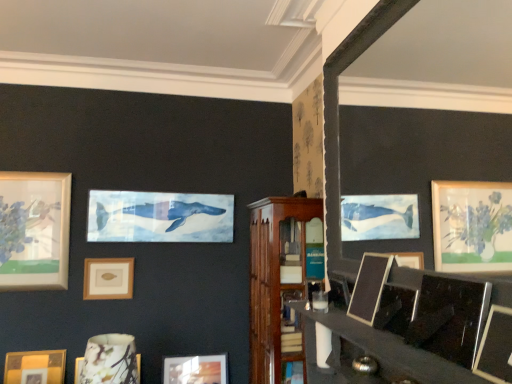
What do you see at coordinates (35, 367) in the screenshot? I see `matte gold picture frame at lower left, which ranks as the 4th picture frame in front-to-back order` at bounding box center [35, 367].

Locate an element on the screen. The width and height of the screenshot is (512, 384). matte wooden picture frame at lower center, which ranks as the second picture frame in back-to-front order is located at coordinates (195, 369).

This screenshot has height=384, width=512. I want to click on wooden picture frame at center, which ranks as the third picture frame in front-to-back order, so click(x=369, y=286).

What is the approximate width of shiny black picture frame at lower right, the sixth picture frame when ordered from left to right?

The width of shiny black picture frame at lower right, the sixth picture frame when ordered from left to right, is 3.60 inches.

The width and height of the screenshot is (512, 384). Find the location of `wooden cabinet at center`. wooden cabinet at center is located at coordinates (279, 281).

Locate an element on the screen. This screenshot has height=384, width=512. matte gold picture frame at lower left, the first picture frame when ordered from left to right is located at coordinates (35, 367).

Visually, is matte gold picture frame at lower left, which ranks as the 4th picture frame in front-to-back order, positioned to the left or to the right of wooden picture frame at center, which is counted as the 5th picture frame, starting from the left?

matte gold picture frame at lower left, which ranks as the 4th picture frame in front-to-back order, is positioned on wooden picture frame at center, which is counted as the 5th picture frame, starting from the left,'s left side.

Is the position of matte gold picture frame at lower left, which ranks as the fourth picture frame in back-to-front order, more distant than that of wooden picture frame at center, which is counted as the 5th picture frame, starting from the left?

Yes, the depth of matte gold picture frame at lower left, which ranks as the fourth picture frame in back-to-front order, is greater than that of wooden picture frame at center, which is counted as the 5th picture frame, starting from the left.

From a real-world perspective, is matte gold picture frame at lower left, which ranks as the 7th picture frame in right-to-left order, positioned above or below wooden picture frame at center, the 3th picture frame in the right-to-left sequence?

matte gold picture frame at lower left, which ranks as the 7th picture frame in right-to-left order, is below wooden picture frame at center, the 3th picture frame in the right-to-left sequence.

Does matte gold picture frame at lower left, the first picture frame when ordered from left to right, touch wooden picture frame at center, the 3th picture frame in the right-to-left sequence?

No.

Which object is further away from the camera, matte wooden picture frame at lower center, the fourth picture frame positioned from the right, or matte gold picture frame at lower left, which ranks as the 7th picture frame in right-to-left order?

Positioned behind is matte wooden picture frame at lower center, the fourth picture frame positioned from the right.

Starting from the matte gold picture frame at lower left, which ranks as the 7th picture frame in right-to-left order, which picture frame is the 3rd one to the right? Please provide its 2D coordinates.

[(195, 369)]

Is matte wooden picture frame at lower center, the fourth picture frame positioned from the right, oriented towards matte gold picture frame at lower left, which ranks as the fourth picture frame in back-to-front order?

No, matte wooden picture frame at lower center, the fourth picture frame positioned from the right, is not oriented towards matte gold picture frame at lower left, which ranks as the fourth picture frame in back-to-front order.

Is matte wooden picture frame at lower center, the sixth picture frame in the front-to-back sequence, shorter than matte gold picture frame at lower left, which ranks as the 4th picture frame in front-to-back order?

In fact, matte wooden picture frame at lower center, the sixth picture frame in the front-to-back sequence, may be taller than matte gold picture frame at lower left, which ranks as the 4th picture frame in front-to-back order.

Where is `the 2nd picture frame above the matte gold picture frame at lower left, which ranks as the fourth picture frame in back-to-front order (from a real-world perspective)`? Image resolution: width=512 pixels, height=384 pixels. the 2nd picture frame above the matte gold picture frame at lower left, which ranks as the fourth picture frame in back-to-front order (from a real-world perspective) is located at coordinates (496, 347).

Is metallic silver picture frame at lower right, which appears as the first picture frame when viewed from the front, positioned behind matte gold picture frame at lower left, which ranks as the fourth picture frame in back-to-front order?

No, metallic silver picture frame at lower right, which appears as the first picture frame when viewed from the front, is in front of matte gold picture frame at lower left, which ranks as the fourth picture frame in back-to-front order.

Is matte gold picture frame at lower left, which ranks as the 4th picture frame in front-to-back order, at the back of metallic silver picture frame at lower right, which appears as the first picture frame when viewed from the front?

No, matte gold picture frame at lower left, which ranks as the 4th picture frame in front-to-back order, is not at the back of metallic silver picture frame at lower right, which appears as the first picture frame when viewed from the front.

Who is taller, shiny black picture frame at lower right, the sixth picture frame when ordered from left to right, or matte wooden picture frame at lower center, the sixth picture frame in the front-to-back sequence?

matte wooden picture frame at lower center, the sixth picture frame in the front-to-back sequence.

Is shiny black picture frame at lower right, the sixth picture frame when ordered from left to right, looking in the opposite direction of matte wooden picture frame at lower center, which ranks as the second picture frame in back-to-front order?

That's not correct — shiny black picture frame at lower right, the sixth picture frame when ordered from left to right, is not looking away from matte wooden picture frame at lower center, which ranks as the second picture frame in back-to-front order.

Is shiny black picture frame at lower right, the 2th picture frame positioned from the front, not close to matte wooden picture frame at lower center, the sixth picture frame in the front-to-back sequence?

shiny black picture frame at lower right, the 2th picture frame positioned from the front, is far away from matte wooden picture frame at lower center, the sixth picture frame in the front-to-back sequence.

Which object is further away from the camera, shiny black picture frame at lower right, the sixth picture frame when ordered from left to right, or matte wooden picture frame at lower center, marked as the fourth picture frame in a left-to-right arrangement?

Positioned behind is matte wooden picture frame at lower center, marked as the fourth picture frame in a left-to-right arrangement.

Based on the photo, from the image's perspective, is metallic silver picture frame at lower right, acting as the seventh picture frame starting from the back, below wooden cabinet at center?

No, from the image's perspective, metallic silver picture frame at lower right, acting as the seventh picture frame starting from the back, is not below wooden cabinet at center.

Which is more to the left, metallic silver picture frame at lower right, arranged as the first picture frame when viewed from the right, or wooden cabinet at center?

Positioned to the left is wooden cabinet at center.

Which object is wider, metallic silver picture frame at lower right, which appears as the first picture frame when viewed from the front, or wooden cabinet at center?

With larger width is wooden cabinet at center.

Can you confirm if metallic silver picture frame at lower right, acting as the seventh picture frame starting from the back, is taller than wooden cabinet at center?

In fact, metallic silver picture frame at lower right, acting as the seventh picture frame starting from the back, may be shorter than wooden cabinet at center.

From the picture: From the image's perspective, is wooden cabinet at center located above or below matte ceramic vase at lower left, arranged as the 3th picture frame when viewed from the back?

wooden cabinet at center is situated higher than matte ceramic vase at lower left, arranged as the 3th picture frame when viewed from the back, in the image.

Which of these two, wooden cabinet at center or matte ceramic vase at lower left, acting as the third picture frame starting from the left, stands taller?

wooden cabinet at center.

From a real-world perspective, is wooden cabinet at center located higher than matte ceramic vase at lower left, arranged as the 3th picture frame when viewed from the back?

Yes.

In the scene shown: Considering the relative sizes of wooden cabinet at center and matte ceramic vase at lower left, the fifth picture frame viewed from the front, in the image provided, is wooden cabinet at center bigger than matte ceramic vase at lower left, the fifth picture frame viewed from the front,?

Yes.

Considering the relative sizes of shiny black picture frame at lower right, which is the sixth picture frame from back to front, and wooden cabinet at center in the image provided, is shiny black picture frame at lower right, which is the sixth picture frame from back to front, shorter than wooden cabinet at center?

Indeed, shiny black picture frame at lower right, which is the sixth picture frame from back to front, has a lesser height compared to wooden cabinet at center.

How different are the orientations of shiny black picture frame at lower right, the sixth picture frame when ordered from left to right, and wooden cabinet at center in degrees?

0.651 degrees.

From a real-world perspective, is shiny black picture frame at lower right, the sixth picture frame when ordered from left to right, physically above wooden cabinet at center?

Yes, from a real-world perspective, shiny black picture frame at lower right, the sixth picture frame when ordered from left to right, is over wooden cabinet at center

Where is `the 3rd picture frame located above the wooden cabinet at center (from a real-world perspective)`? the 3rd picture frame located above the wooden cabinet at center (from a real-world perspective) is located at coordinates (450, 318).

From a real-world perspective, starting from the wooden picture frame at center, arranged as the fifth picture frame when viewed from the back, which picture frame is the 4th one below it? Please provide its 2D coordinates.

[(35, 367)]

Identify the location of the 2nd picture frame below the matte gold picture frame at lower left, which ranks as the 7th picture frame in right-to-left order (from the image's perspective). (195, 369).

Which object lies further to the anchor point wooden cabinet at center, matte ceramic vase at lower left, arranged as the 3th picture frame when viewed from the back, or shiny black picture frame at lower right, which is the sixth picture frame from back to front?

shiny black picture frame at lower right, which is the sixth picture frame from back to front, is positioned further to the anchor wooden cabinet at center.

When comparing their distances from wooden cabinet at center, does wooden picture frame at center, arranged as the fifth picture frame when viewed from the back, or matte ceramic vase at lower left, arranged as the 3th picture frame when viewed from the back, seem closer?

Among the two, wooden picture frame at center, arranged as the fifth picture frame when viewed from the back, is located nearer to wooden cabinet at center.

Based on their spatial positions, is matte wooden picture frame at lower center, the sixth picture frame in the front-to-back sequence, or matte gold picture frame at center-left, the 6th picture frame in the right-to-left sequence, closer to wooden cabinet at center?

Among the two, matte wooden picture frame at lower center, the sixth picture frame in the front-to-back sequence, is located nearer to wooden cabinet at center.

When comparing their distances from matte gold picture frame at lower left, which ranks as the fourth picture frame in back-to-front order, does matte wooden picture frame at lower center, the fourth picture frame positioned from the right, or matte ceramic vase at lower left, acting as the third picture frame starting from the left, seem closer?

The object closer to matte gold picture frame at lower left, which ranks as the fourth picture frame in back-to-front order, is matte wooden picture frame at lower center, the fourth picture frame positioned from the right.

Which object lies nearer to the anchor point wooden picture frame at center, which ranks as the third picture frame in front-to-back order, matte gold picture frame at center-left, acting as the 7th picture frame starting from the front, or matte wooden picture frame at lower center, marked as the fourth picture frame in a left-to-right arrangement?

matte wooden picture frame at lower center, marked as the fourth picture frame in a left-to-right arrangement, is closer to wooden picture frame at center, which ranks as the third picture frame in front-to-back order.

When comparing their distances from matte gold picture frame at center-left, which is counted as the 1th picture frame, starting from the back, does wooden cabinet at center or matte gold picture frame at lower left, which ranks as the 4th picture frame in front-to-back order, seem further?

wooden cabinet at center.

When comparing their distances from shiny black picture frame at lower right, the 2th picture frame positioned from the front, does matte gold picture frame at center-left, which appears as the 2th picture frame when viewed from the left, or matte ceramic vase at lower left, arranged as the 3th picture frame when viewed from the back, seem further?

matte gold picture frame at center-left, which appears as the 2th picture frame when viewed from the left, is positioned further to the anchor shiny black picture frame at lower right, the 2th picture frame positioned from the front.

Looking at this image, considering their positions, is metallic silver picture frame at lower right, which appears as the first picture frame when viewed from the front, positioned further to shiny black picture frame at lower right, the 2th picture frame positioned from the front, than wooden cabinet at center?

Based on the image, wooden cabinet at center appears to be further to shiny black picture frame at lower right, the 2th picture frame positioned from the front.

Where is `shelf located between matte gold picture frame at lower left, the first picture frame when ordered from left to right, and wooden picture frame at center, arranged as the fifth picture frame when viewed from the back, in the left-right direction`? shelf located between matte gold picture frame at lower left, the first picture frame when ordered from left to right, and wooden picture frame at center, arranged as the fifth picture frame when viewed from the back, in the left-right direction is located at coordinates (279, 281).

The image size is (512, 384). Identify the location of shelf between matte gold picture frame at lower left, which ranks as the 4th picture frame in front-to-back order, and metallic silver picture frame at lower right, acting as the 7th picture frame starting from the left, from left to right. (279, 281).

I want to click on shelf between shiny black picture frame at lower right, which is the 2th picture frame from right to left, and matte gold picture frame at center-left, which is counted as the 1th picture frame, starting from the back, in the front-back direction, so click(x=279, y=281).

Image resolution: width=512 pixels, height=384 pixels. In order to click on shelf positioned between shiny black picture frame at lower right, the 2th picture frame positioned from the front, and matte wooden picture frame at lower center, the sixth picture frame in the front-to-back sequence, from near to far in this screenshot , I will do `click(279, 281)`.